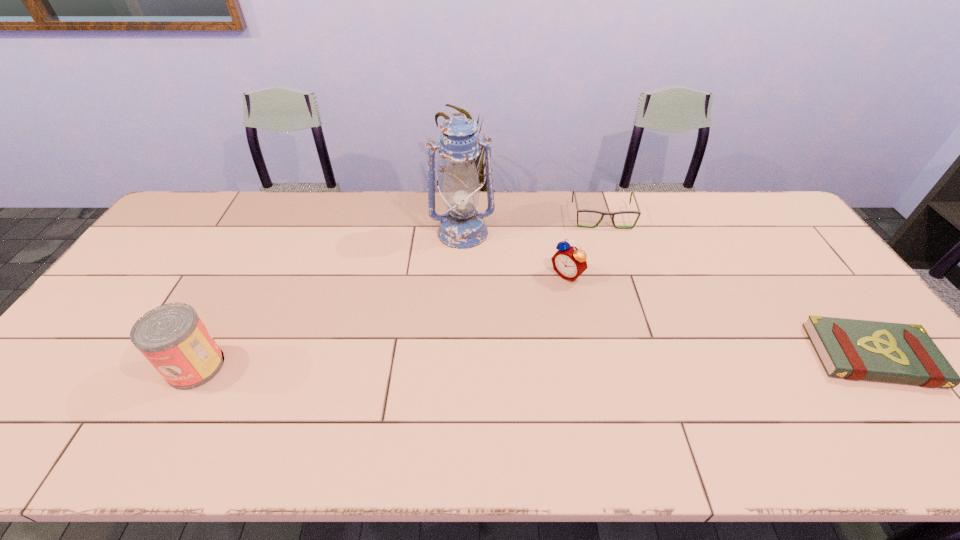
You are a GUI agent. You are given a task and a screenshot of the screen. Output one action in this format:
    pyautogui.click(x=<x>, y=<y>)
    Task: Click on the free space on the desktop that is between the fourth shortest object and the book and is positioned on the lens of the second shortest object
    This screenshot has width=960, height=540.
    Given the screenshot: What is the action you would take?
    pyautogui.click(x=636, y=360)

Find the location of a particular element. The image size is (960, 540). vacant spot on the desktop that is between the fourth shortest object and the rightmost object and is positioned on the front-facing side of the third nearest object is located at coordinates (469, 362).

Where is `vacant space on the desktop that is between the second tallest object and the shortest object and is positioned on the front-facing side of the lantern`? The width and height of the screenshot is (960, 540). vacant space on the desktop that is between the second tallest object and the shortest object and is positioned on the front-facing side of the lantern is located at coordinates (485, 362).